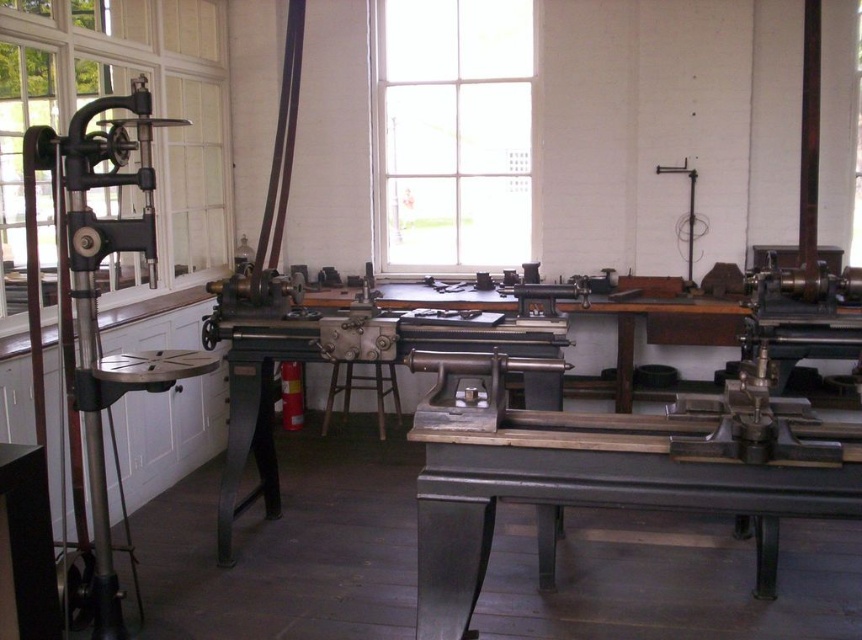
Does clear glass window at center have a lesser width compared to polished metal vise at left?

Incorrect, clear glass window at center's width is not less than polished metal vise at left's.

Can you confirm if clear glass window at center is bigger than polished metal vise at left?

Yes.

In order to click on clear glass window at center in this screenshot , I will do `click(454, 131)`.

The width and height of the screenshot is (862, 640). What are the coordinates of `clear glass window at center` in the screenshot? It's located at (454, 131).

Can you confirm if clear glass window at left is bigger than metallic gray table at center?

Indeed, clear glass window at left has a larger size compared to metallic gray table at center.

Does clear glass window at left have a lesser width compared to metallic gray table at center?

Indeed, clear glass window at left has a lesser width compared to metallic gray table at center.

Is point (9, 61) positioned after point (753, 497)?

Yes, point (9, 61) is farther from viewer.

Find the location of `clear glass window at left`. clear glass window at left is located at coordinates (122, 93).

Is metallic gray table at center shorter than polished metal vise at left?

Yes.

Consider the image. Does metallic gray table at center appear over polished metal vise at left?

No.

Which is behind, point (626, 419) or point (29, 221)?

The point (29, 221) is more distant.

You are a GUI agent. You are given a task and a screenshot of the screen. Output one action in this format:
    pyautogui.click(x=<x>, y=<y>)
    Task: Click on the metallic gray table at center
    This screenshot has height=640, width=862.
    Given the screenshot: What is the action you would take?
    pyautogui.click(x=603, y=490)